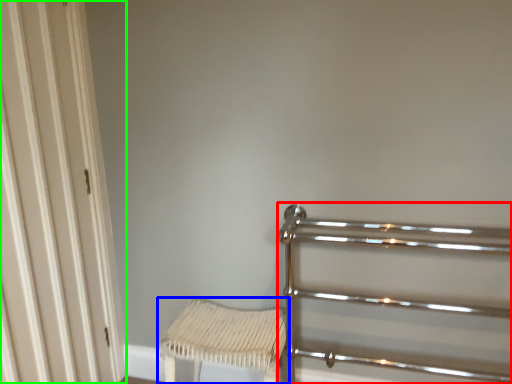
Question: Estimate the real-world distances between objects in this image. Which object is closer to rail (highlighted by a red box), furniture (highlighted by a blue box) or door (highlighted by a green box)?

Choices:
 (A) furniture
 (B) door

Answer: (A)